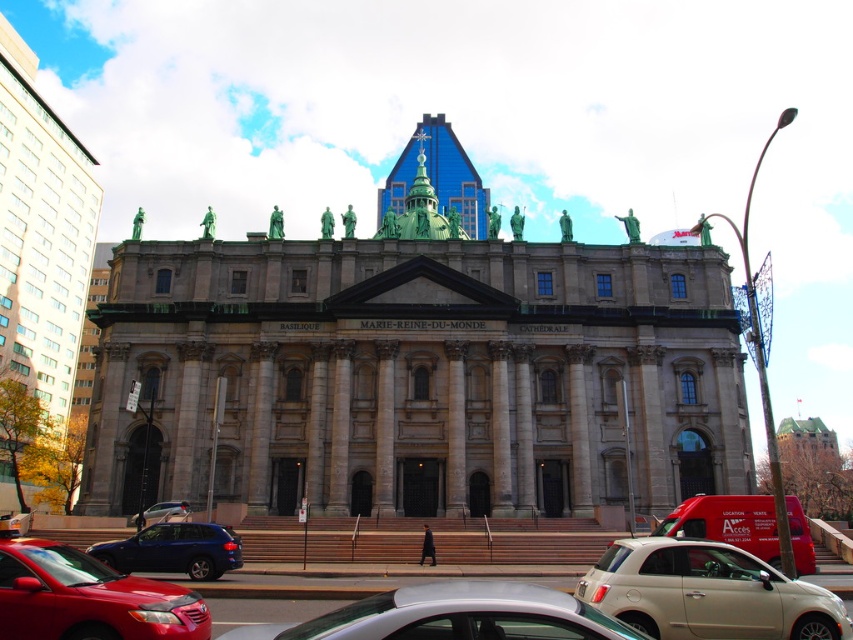
You are a delivery driver who needs to park your vehicle in the Basilique Marie Reine du Monde parking lot. The parking space you want to use has a height restriction of 2 meters. You see a beige matte car at lower center and a matte silver car at center. Which car is more likely to exceed the height limit?

The beige matte car at lower center is much taller than the matte silver car at center, so it is more likely to exceed the height limit of 2 meters.

You are a visitor arriving at the Basilique Marie Reine du Monde. You see a silver metallic sedan at lower center and a shiny red sedan at lower left. Which car is closer to the cathedral entrance?

The shiny red sedan at lower left is closer to the cathedral entrance because the silver metallic sedan at lower center is positioned on the right side of it, meaning the red car is between the cathedral entrance and the silver car.

You are a delivery person who needs to park a 2.5 meter tall truck in a parking lot near the Basilique Marie Reine du Monde. The parking spot has a height restriction of 2 meters. You see a silver metallic sedan at lower center and a shiny blue suv at lower left parked there. Which vehicle should you avoid parking next to to stay within the height limit?

The silver metallic sedan at lower center is much taller than the shiny blue suv at lower left. Since the parking spot has a 2 meter height restriction and the truck is 2.5 meters tall, you should avoid parking next to the silver metallic sedan at lower center because it is taller and may block the truck from fitting within the height limit.